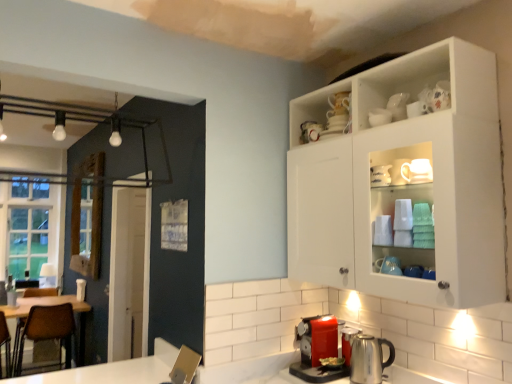
Question: Is white ceramic mug at upper center, acting as the second tableware starting from the right, in front of or behind white glossy mug at upper center, arranged as the 2th tableware when viewed from the left, in the image?

Choices:
 (A) front
 (B) behind

Answer: (A)

Question: From a real-world perspective, relative to white glossy mug at upper center, acting as the 2th tableware starting from the front, is white ceramic mug at upper center, the second tableware positioned from the top, vertically above or below?

Choices:
 (A) above
 (B) below

Answer: (B)

Question: Which of these objects is positioned closest to the clear glass window at left?

Choices:
 (A) white glossy mug at upper center, which is counted as the 1th tableware, starting from the back
 (B) metallic silver kettle at lower center
 (C) brown leather chair at left
 (D) white ceramic mug at upper center, the 1th tableware from the left
 (E) white glossy cabinet at upper right

Answer: (C)

Question: Considering the real-world distances, which object is closest to the metallic silver kettle at lower center?

Choices:
 (A) white glossy mug at upper center, which is counted as the 1th tableware, starting from the back
 (B) clear glass window at left
 (C) brown leather chair at left
 (D) white ceramic mug at upper center, acting as the second tableware starting from the right
 (E) white glossy cabinet at upper right

Answer: (E)